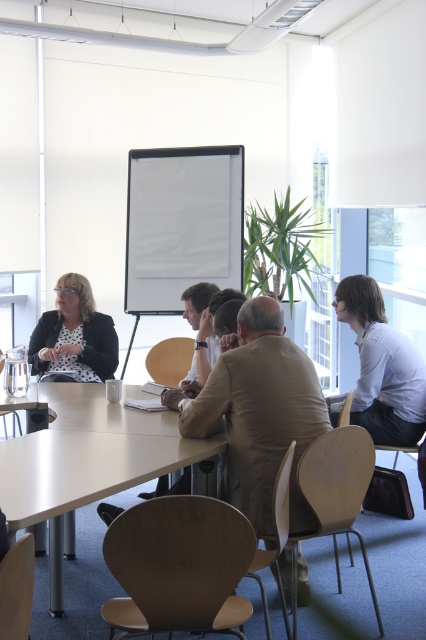
Question: Among these points, which one is farthest from the camera?

Choices:
 (A) (60, 305)
 (B) (284, 362)
 (C) (219, 260)

Answer: (C)

Question: Which point appears farthest from the camera in this image?

Choices:
 (A) (238, 385)
 (B) (425, 372)

Answer: (B)

Question: Can you confirm if light brown leather jacket at center is wider than white shirt at upper right?

Choices:
 (A) no
 (B) yes

Answer: (B)

Question: Does light brown leather jacket at center have a lesser width compared to white matte projection screen at center?

Choices:
 (A) no
 (B) yes

Answer: (B)

Question: Which object is farther from the camera taking this photo?

Choices:
 (A) white matte projection screen at center
 (B) matte black blazer at left
 (C) white shirt at upper right

Answer: (A)

Question: Is white shirt at upper right positioned at the back of matte black blazer at left?

Choices:
 (A) yes
 (B) no

Answer: (B)